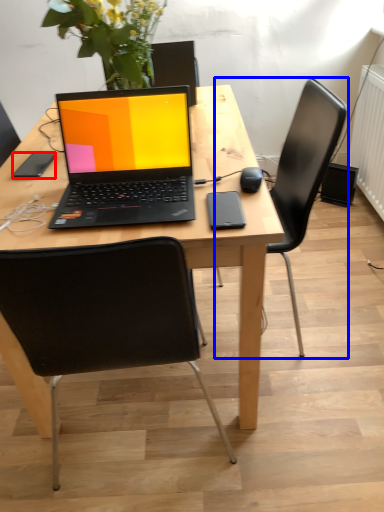
Question: Among these objects, which one is nearest to the camera, mobile phone (highlighted by a red box) or chair (highlighted by a blue box)?

Choices:
 (A) mobile phone
 (B) chair

Answer: (B)